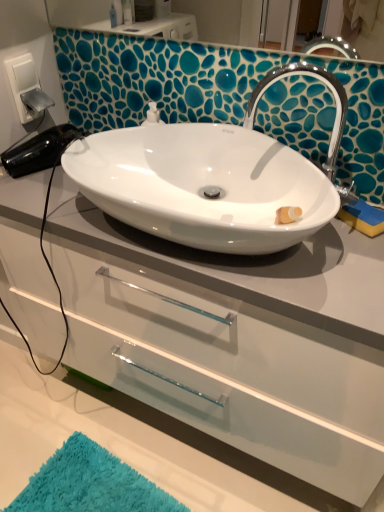
Question: Is white glossy sink at center wider or thinner than turquoise shaggy bath mat at lower left?

Choices:
 (A) thin
 (B) wide

Answer: (A)

Question: Considering the positions of point (144, 207) and point (185, 507), is point (144, 207) closer or farther from the camera than point (185, 507)?

Choices:
 (A) farther
 (B) closer

Answer: (B)

Question: Considering the real-world distances, which object is farthest from the white glossy cabinet at center?

Choices:
 (A) turquoise shaggy bath mat at lower left
 (B) silver metallic switch at upper left
 (C) white glossy sink at center
 (D) chrome metallic faucet at upper right

Answer: (B)

Question: Which object is the farthest from the white glossy cabinet at center?

Choices:
 (A) turquoise shaggy bath mat at lower left
 (B) white glossy sink at center
 (C) chrome metallic faucet at upper right
 (D) silver metallic switch at upper left

Answer: (D)